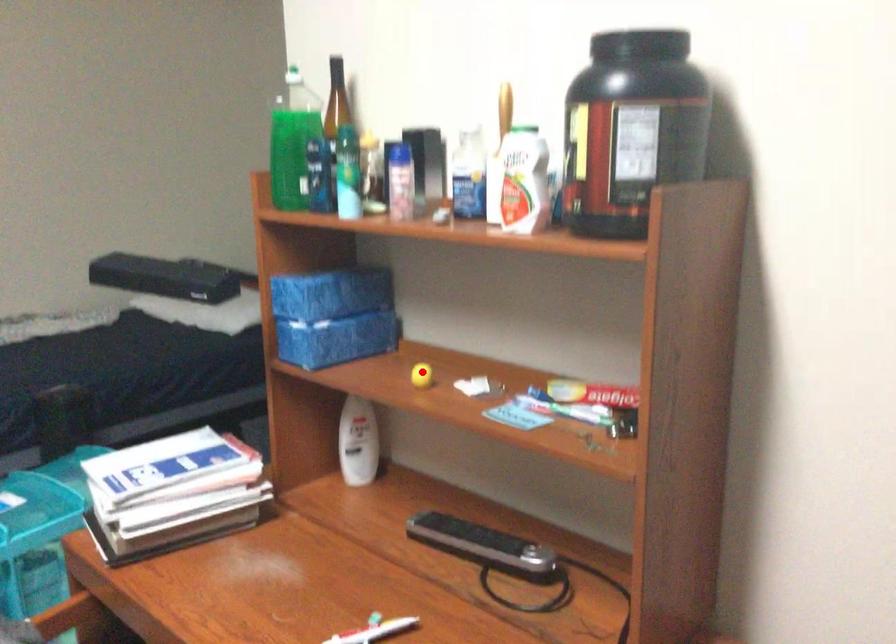
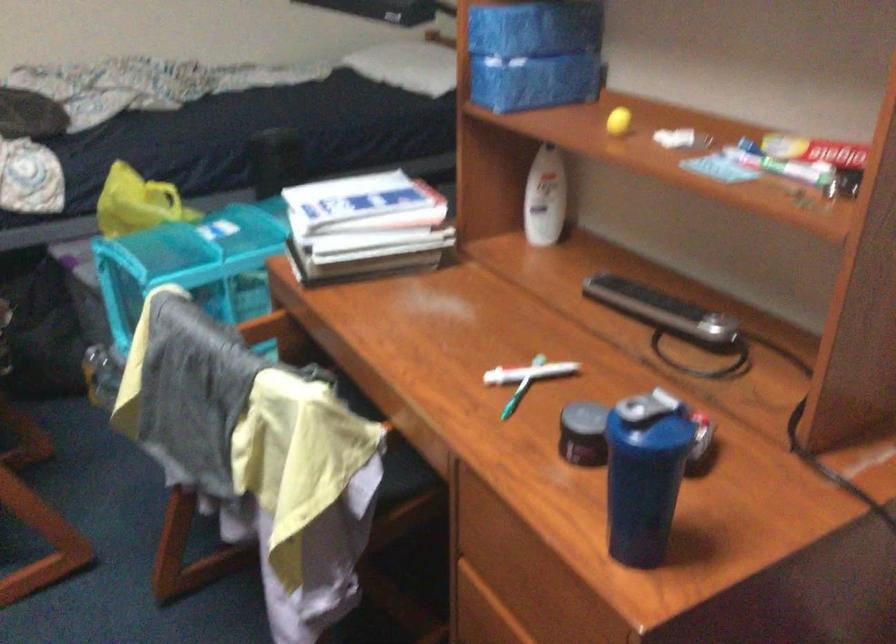
Where in the second image is the point corresponding to the highlighted location from the first image?

(617, 120)